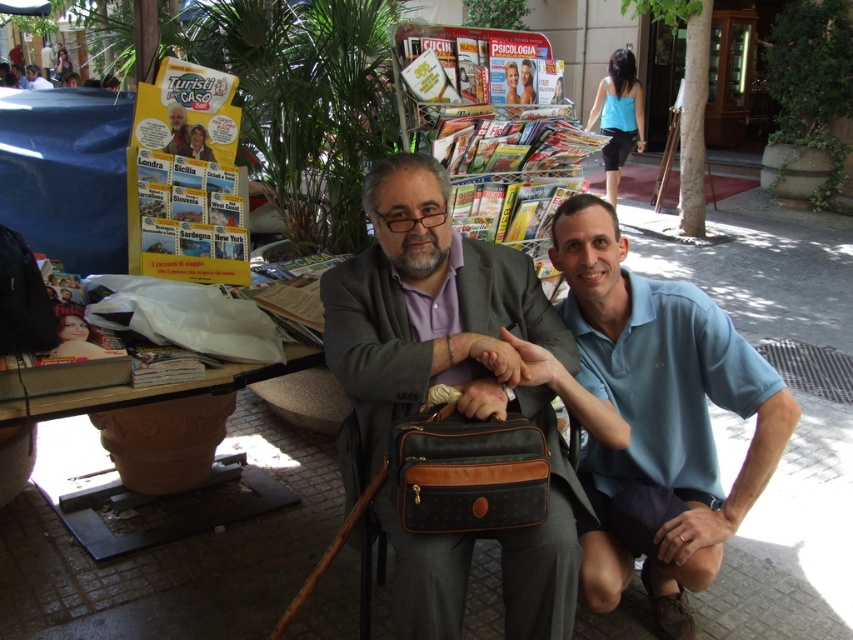
You are a tailor measuring for a custom shirt. You need to know if the light blue cotton polo shirt at lower right can fit into the matte black magazine at upper left. Can it fit?

The light blue cotton polo shirt at lower right might be wider than matte black magazine at upper left, so it may not fit inside the magazine.

In the scene shown: You are standing in front of the kiosk and want to find the matte black bag at center. Can you tell me where exactly the point at coordinates (454, 387) is located?

The point at coordinates (454, 387) is located on the matte black bag at center.

You are standing in front of the kiosk and want to reach both points. Which point, point (x=602, y=484) or point (x=166, y=147), is closer to you?

Point (x=602, y=484) is closer to the viewer than point (x=166, y=147).